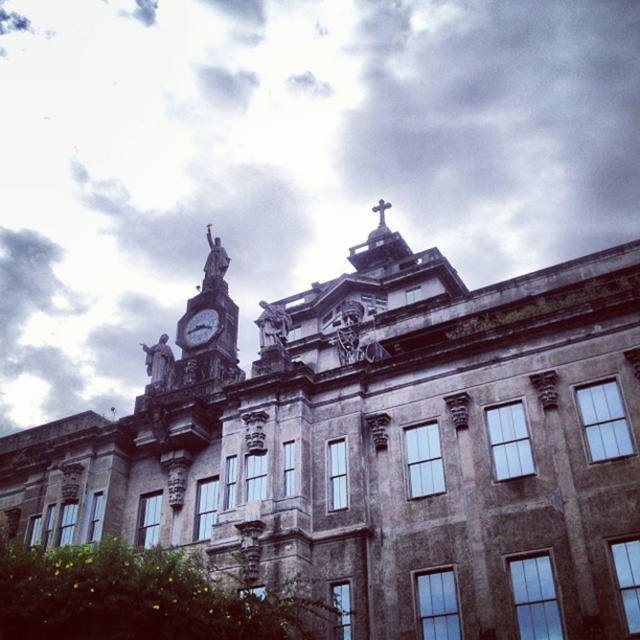
You are an architect analyzing the placement of elements in the image. The building has a clock tower on its left side with a statue holding a staff. You need to determine the position of the white cloudy sky at upper center relative to the clock tower. Which object is higher in the image?

The white cloudy sky at upper center is higher than the clock tower because the sky is located at point [285,157], which is above the clock tower.

You are standing at the base of the historic building and want to know if you can touch both the white cloudy sky at upper center and the metallic gray clock at upper center at the same time. Based on their distance, is this possible?

The distance between the white cloudy sky at upper center and the metallic gray clock at upper center is 164.20 meters. Since this distance is too large for a person to reach both simultaneously, you cannot touch them at the same time.

You are an architect analyzing the building facade. You notice the white cloudy sky at upper center and the metallic gray clock at upper center. Which of these two elements is positioned closer to the front of the building?

The white cloudy sky at upper center is further to the viewer than the metallic gray clock at upper center, so the metallic gray clock at upper center is closer to the front of the building.